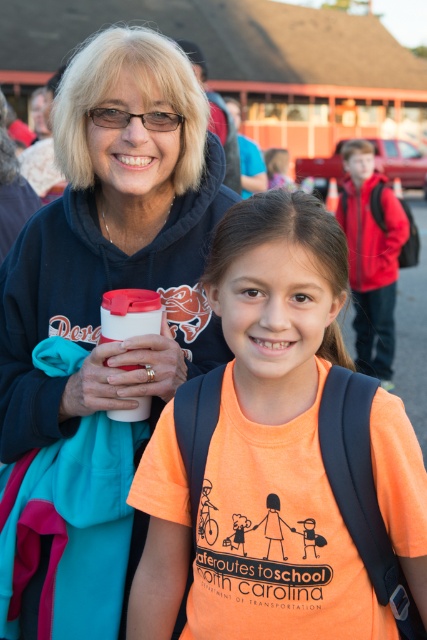
Is orange cotton shirt at center in front of matte black hoodie at upper left?

Yes.

Is point (253, 368) closer to viewer compared to point (49, 218)?

Yes.

Identify the location of orange cotton shirt at center. (277, 436).